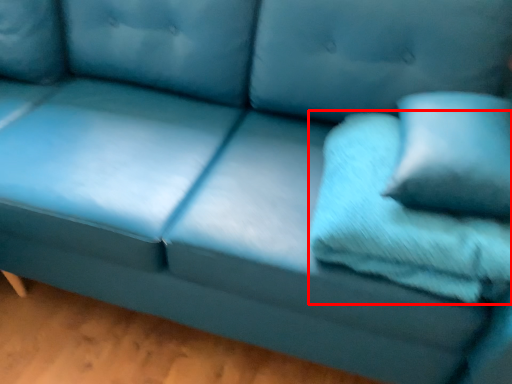
Question: Where is pillow (annotated by the red box) located in relation to pillow in the image?

Choices:
 (A) left
 (B) right

Answer: (A)